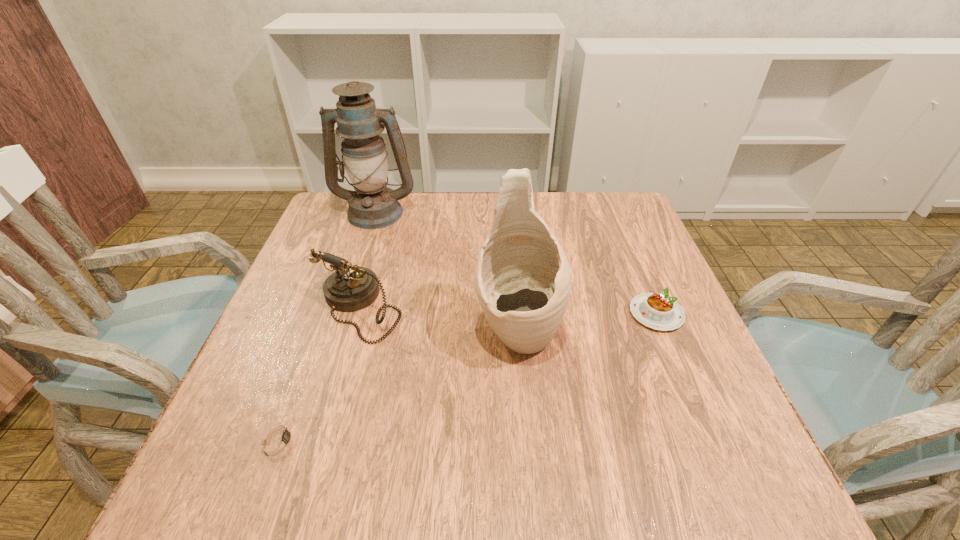
At what (x,y) coordinates should I click in order to perform the action: click on vacant region between the pitcher and the pudding. Please return your answer as a coordinate pair (x, y). Looking at the image, I should click on (x=587, y=323).

Where is `free point between the third shortest object and the nearest object`? Image resolution: width=960 pixels, height=540 pixels. free point between the third shortest object and the nearest object is located at coordinates (319, 374).

Identify the location of vacant space that is in between the farthest object and the telephone. The image size is (960, 540). (367, 260).

You are a GUI agent. You are given a task and a screenshot of the screen. Output one action in this format:
    pyautogui.click(x=<x>, y=<y>)
    Task: Click on the free point between the nearest object and the farthest object
    
    Given the screenshot: What is the action you would take?
    pyautogui.click(x=327, y=326)

Find the location of `free space between the watch and the farthest object`. free space between the watch and the farthest object is located at coordinates (327, 326).

Locate which object is the fourth closest to the pitcher. Please provide its 2D coordinates. Your answer should be formatted as a tuple, i.e. [(x, y)], where the tuple contains the x and y coordinates of a point satisfying the conditions above.

[(372, 205)]

Locate an element on the screen. Image resolution: width=960 pixels, height=540 pixels. object that is the fourth closest to the pudding is located at coordinates (279, 439).

Find the location of a particular element. free space that satisfies the following two spatial constraints: 1. on the front side of the oil lamp; 2. on the left side of the pudding is located at coordinates (343, 314).